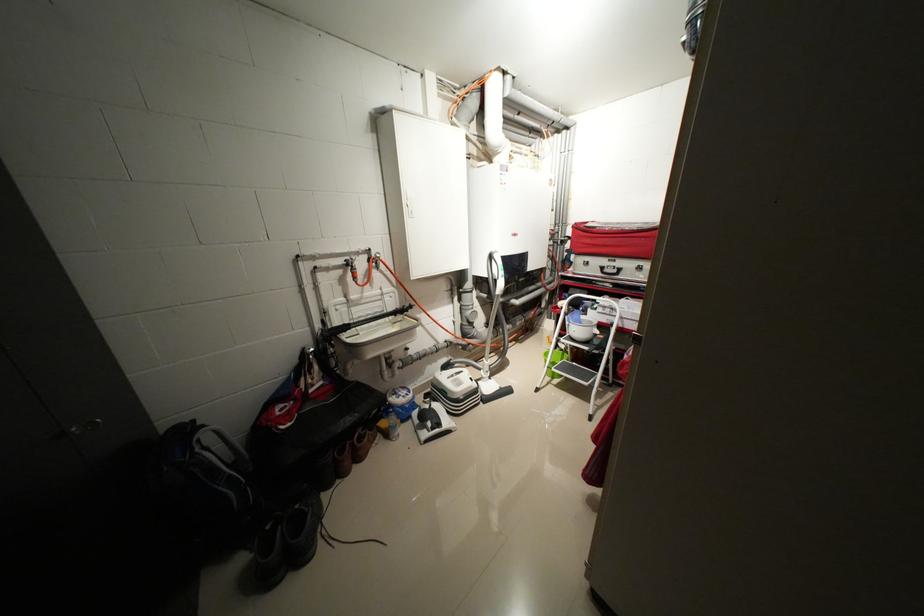
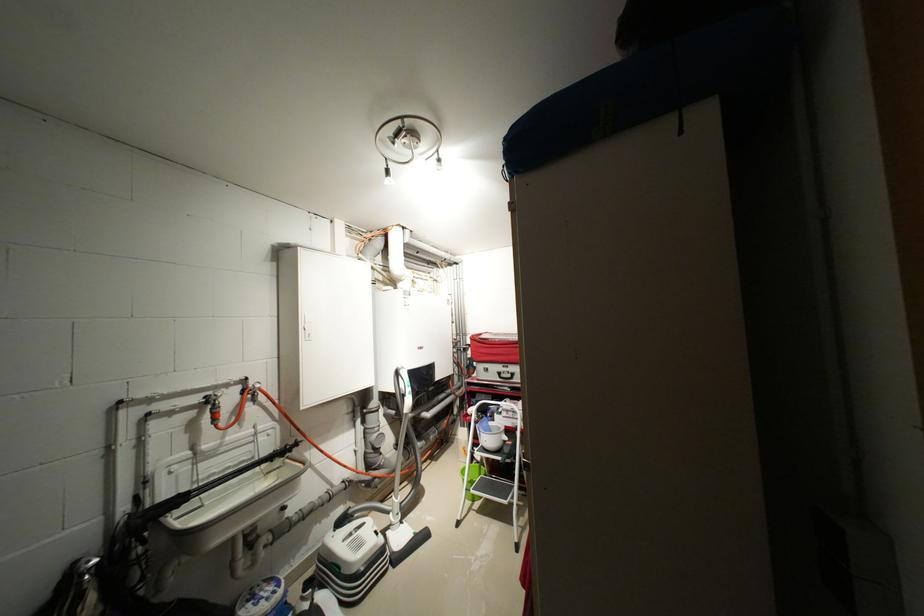
Locate, in the second image, the point that corresponds to (357,275) in the first image.

(214, 416)